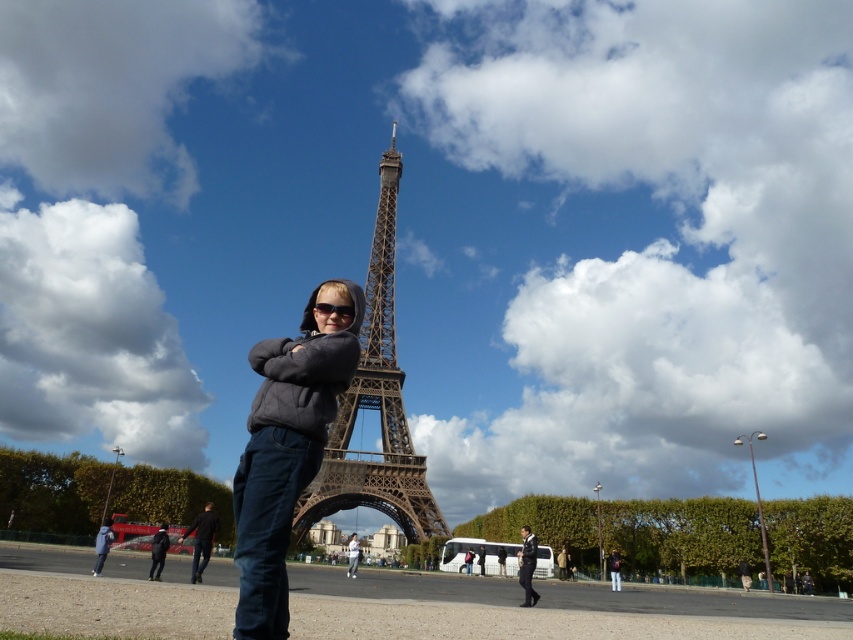
You are a photographer trying to capture a clear shot of the Eiffel Tower. There is a person wearing a matte gray hoodie at center and dark blue jeans at lower left blocking your view. Which object should you move to get a better view of the tower?

The matte gray hoodie at center is in front of the dark blue jeans at lower left, so you should move the matte gray hoodie at center to get a better view of the Eiffel Tower.

You are a photographer standing at the Eiffel Tower. You want to take a photo that includes both the dark blue jeans at lower left and the dark blue jeans at lower center. Given that your camera has a maximum zoom range of 60 meters, will you be able to capture both subjects in a single frame without moving closer?

The distance between the dark blue jeans at lower left and dark blue jeans at lower center is 70.35 meters. Since your camera can only zoom up to 60 meters, you won be able to capture both subjects in a single frame without moving closer.